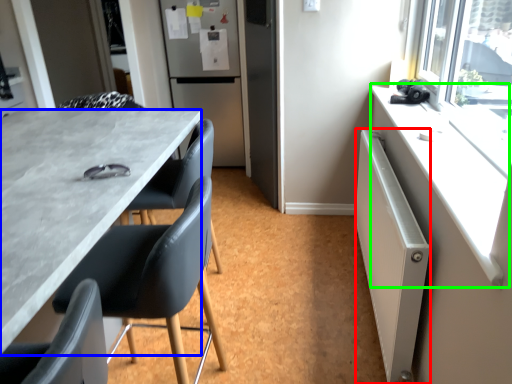
Question: Which object is positioned closest to radiator (highlighted by a red box)? Select from desk (highlighted by a blue box) and counter top (highlighted by a green box).

Choices:
 (A) desk
 (B) counter top

Answer: (B)